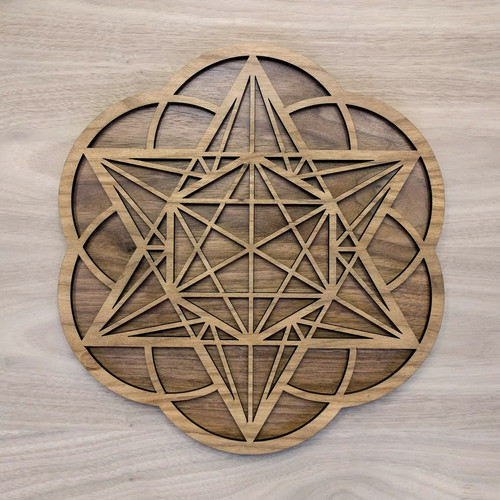
In order to click on table in this screenshot , I will do `click(44, 122)`.